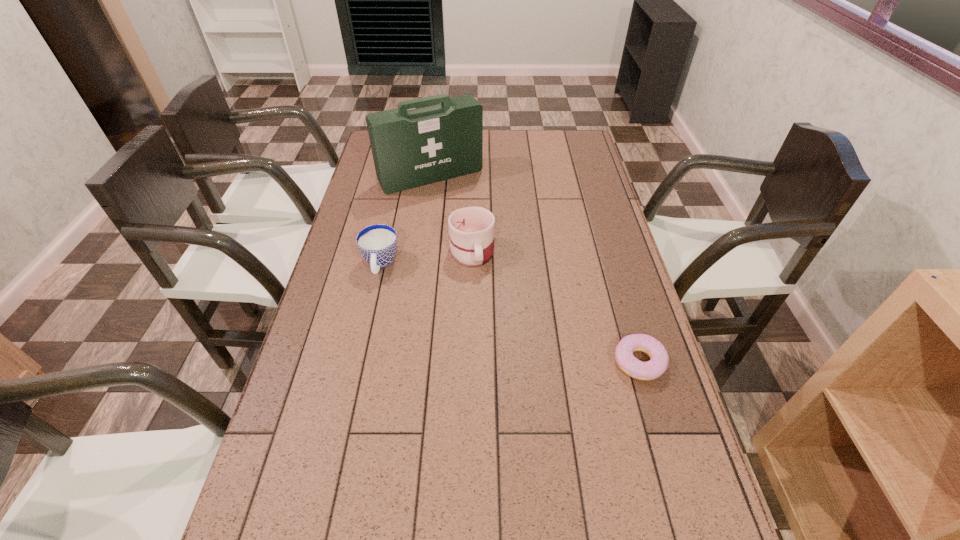
Image resolution: width=960 pixels, height=540 pixels. I want to click on free location at the right edge of the desktop, so click(606, 401).

The height and width of the screenshot is (540, 960). Find the location of `free region at the far left corner of the desktop`. free region at the far left corner of the desktop is located at coordinates (372, 157).

Identify the location of unoccupied position between the third tallest object and the rightmost object. (510, 313).

Find the location of a particular element. The image size is (960, 540). free space that is in between the third shortest object and the nearest object is located at coordinates click(x=556, y=307).

Where is `vacant space in between the farthest object and the rightmost object`? The width and height of the screenshot is (960, 540). vacant space in between the farthest object and the rightmost object is located at coordinates (535, 269).

Locate an element on the screen. The width and height of the screenshot is (960, 540). empty location between the tallest object and the nearest object is located at coordinates (535, 269).

Locate an element on the screen. The height and width of the screenshot is (540, 960). free space between the shortest object and the first-aid kit is located at coordinates (535, 269).

Identify the location of free space between the shortest object and the farthest object. (535, 269).

This screenshot has width=960, height=540. Find the location of `free spot between the second tallest object and the third tallest object`. free spot between the second tallest object and the third tallest object is located at coordinates (426, 258).

At what (x,y) coordinates should I click in order to perform the action: click on empty space that is in between the mug and the doughnut. Please return your answer as a coordinate pair (x, y). The height and width of the screenshot is (540, 960). Looking at the image, I should click on [556, 307].